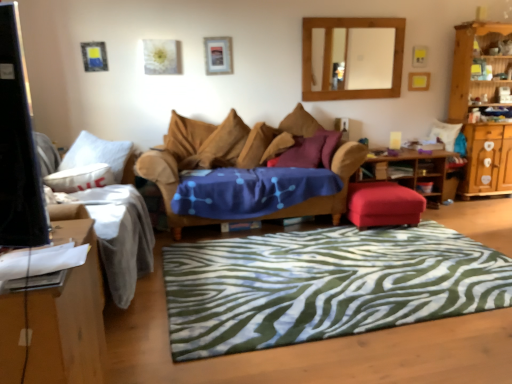
What do you see at coordinates (183, 160) in the screenshot? The image size is (512, 384). I see `velvet brown couch at center, placed as the 1th studio couch when sorted from right to left` at bounding box center [183, 160].

The height and width of the screenshot is (384, 512). What do you see at coordinates (362, 58) in the screenshot? I see `wooden framed mirror at upper center` at bounding box center [362, 58].

This screenshot has width=512, height=384. I want to click on red fabric ottoman at lower right, so click(x=383, y=204).

What do you see at coordinates (323, 285) in the screenshot?
I see `green zebra-patterned rug at center` at bounding box center [323, 285].

Find the location of a particular element. Image resolution: width=512 pixels, height=384 pixels. wooden desk at left is located at coordinates (69, 317).

Where is `the 2nd pillow above the brown fabric pillow at center, the 2th pillow positioned from the right (from the image's perspective)`? This screenshot has height=384, width=512. the 2nd pillow above the brown fabric pillow at center, the 2th pillow positioned from the right (from the image's perspective) is located at coordinates (300, 123).

From a real-world perspective, which is physically below, purple fabric pillow at center, the 4th pillow when ordered from left to right, or brown fabric pillow at center, positioned as the 3th pillow in left-to-right order?

brown fabric pillow at center, positioned as the 3th pillow in left-to-right order, is physically lower.

Is purple fabric pillow at center, the 4th pillow when ordered from left to right, looking in the opposite direction of brown fabric pillow at center, the 2th pillow positioned from the right?

No.

Could brown fabric pillow at center, positioned as the 3th pillow in left-to-right order, be considered to be inside purple fabric pillow at center, positioned as the 1th pillow in right-to-left order?

No, purple fabric pillow at center, positioned as the 1th pillow in right-to-left order, does not contain brown fabric pillow at center, positioned as the 3th pillow in left-to-right order.

From a real-world perspective, is white fabric couch at left, the 1th studio couch in the left-to-right sequence, physically located above or below green zebra-patterned rug at center?

In terms of real-world spatial position, white fabric couch at left, the 1th studio couch in the left-to-right sequence, is above green zebra-patterned rug at center.

From the image's perspective, would you say white fabric couch at left, positioned as the second studio couch in right-to-left order, is shown under green zebra-patterned rug at center?

No, from the image's perspective, white fabric couch at left, positioned as the second studio couch in right-to-left order, is not below green zebra-patterned rug at center.

Is white fabric couch at left, positioned as the second studio couch in right-to-left order, positioned with its back to green zebra-patterned rug at center?

No.

The height and width of the screenshot is (384, 512). What are the coordinates of `the 2nd studio couch counting from the left of the green zebra-patterned rug at center` in the screenshot? It's located at (115, 216).

From the image's perspective, would you say white fabric couch at left, positioned as the second studio couch in right-to-left order, is positioned over wooden shelf at center?

No, from the image's perspective, white fabric couch at left, positioned as the second studio couch in right-to-left order, is not above wooden shelf at center.

How much distance is there between white fabric couch at left, the 1th studio couch in the left-to-right sequence, and wooden shelf at center?

2.43 meters.

Is the surface of white fabric couch at left, positioned as the second studio couch in right-to-left order, in direct contact with wooden shelf at center?

No, white fabric couch at left, positioned as the second studio couch in right-to-left order, is not touching wooden shelf at center.

From a real-world perspective, is white fabric couch at left, the 1th studio couch in the left-to-right sequence, physically located above or below wooden shelf at center?

In terms of real-world spatial position, white fabric couch at left, the 1th studio couch in the left-to-right sequence, is above wooden shelf at center.

Which point is more distant from viewer, (62, 356) or (372, 202)?

Point (372, 202)

Looking at this image, from a real-world perspective, is wooden desk at left physically located above or below red fabric ottoman at lower right?

From a real-world perspective, wooden desk at left is physically above red fabric ottoman at lower right.

Considering the relative sizes of wooden desk at left and red fabric ottoman at lower right in the image provided, is wooden desk at left taller than red fabric ottoman at lower right?

Indeed, wooden desk at left has a greater height compared to red fabric ottoman at lower right.

Between wooden desk at left and red fabric ottoman at lower right, which one has smaller width?

red fabric ottoman at lower right is thinner.

From the picture: Between wooden framed mirror at upper center and brown fabric pillow at center, the 2th pillow from the left, which one has smaller width?

wooden framed mirror at upper center is thinner.

From a real-world perspective, is wooden framed mirror at upper center beneath brown fabric pillow at center, the 2th pillow from the left?

No.

In the image, is wooden framed mirror at upper center positioned in front of or behind brown fabric pillow at center, the 2th pillow from the left?

Clearly, wooden framed mirror at upper center is behind brown fabric pillow at center, the 2th pillow from the left.

From the image's perspective, which is below, wooden framed mirror at upper center or brown fabric pillow at center, arranged as the third pillow when viewed from the right?

From the image's view, brown fabric pillow at center, arranged as the third pillow when viewed from the right, is below.

Is wooden cabinet at right located within red fabric ottoman at lower right?

No, wooden cabinet at right is not surrounded by red fabric ottoman at lower right.

This screenshot has width=512, height=384. I want to click on stool on the left of the wooden cabinet at right, so click(383, 204).

Considering the sizes of red fabric ottoman at lower right and wooden cabinet at right in the image, is red fabric ottoman at lower right wider or thinner than wooden cabinet at right?

red fabric ottoman at lower right is wider than wooden cabinet at right.

Is red fabric ottoman at lower right positioned before wooden cabinet at right?

Yes, red fabric ottoman at lower right is closer to the viewer.

Is brown fabric pillow at center, positioned as the 3th pillow in left-to-right order, bigger or smaller than metallic silver picture frame at upper center?

Considering their sizes, brown fabric pillow at center, positioned as the 3th pillow in left-to-right order, takes up more space than metallic silver picture frame at upper center.

From the image's perspective, which is below, brown fabric pillow at center, positioned as the 3th pillow in left-to-right order, or metallic silver picture frame at upper center?

brown fabric pillow at center, positioned as the 3th pillow in left-to-right order, from the image's perspective.

Is brown fabric pillow at center, positioned as the 3th pillow in left-to-right order, next to metallic silver picture frame at upper center and touching it?

No, brown fabric pillow at center, positioned as the 3th pillow in left-to-right order, is not in contact with metallic silver picture frame at upper center.

From a real-world perspective, which object stands above the other?

From a 3D spatial view, metallic silver picture frame at upper center is above.

Find the location of a particular element. pillow that is the 1st object to the left of the purple fabric pillow at center, the 4th pillow when ordered from left to right, starting at the anchor is located at coordinates (x=277, y=146).

The width and height of the screenshot is (512, 384). What are the coordinates of `mat behind the white fabric couch at left, positioned as the second studio couch in right-to-left order` in the screenshot? It's located at (323, 285).

Which object lies nearer to the anchor point purple fabric pillow at center, positioned as the 1th pillow in right-to-left order, brown fabric pillow at center, arranged as the third pillow when viewed from the right, or green zebra-patterned rug at center?

brown fabric pillow at center, arranged as the third pillow when viewed from the right, lies closer to purple fabric pillow at center, positioned as the 1th pillow in right-to-left order, than the other object.

Based on their spatial positions, is wooden framed mirror at upper center or white fabric couch at left, the 1th studio couch in the left-to-right sequence, closer to green zebra-patterned rug at center?

white fabric couch at left, the 1th studio couch in the left-to-right sequence, is positioned closer to the anchor green zebra-patterned rug at center.

Based on the photo, based on their spatial positions, is wooden cabinet at right or brown fabric pillow at center, arranged as the third pillow when viewed from the right, closer to white fabric couch at left, positioned as the second studio couch in right-to-left order?

Among the two, brown fabric pillow at center, arranged as the third pillow when viewed from the right, is located nearer to white fabric couch at left, positioned as the second studio couch in right-to-left order.

When comparing their distances from metallic silver picture frame at upper center, does wooden desk at left or wooden framed mirror at upper center seem further?

Among the two, wooden desk at left is located further to metallic silver picture frame at upper center.

From the image, which object appears to be nearer to white soft pillow at left, the first pillow positioned from the left, brown fabric pillow at center, the 2th pillow positioned from the right, or red fabric ottoman at lower right?

Among the two, brown fabric pillow at center, the 2th pillow positioned from the right, is located nearer to white soft pillow at left, the first pillow positioned from the left.

From the image, which object appears to be nearer to metallic silver picture frame at upper center, green zebra-patterned rug at center or wooden desk at left?

Result: green zebra-patterned rug at center lies closer to metallic silver picture frame at upper center than the other object.

Considering their positions, is brown fabric pillow at center, the 2th pillow from the left, positioned closer to white fabric couch at left, positioned as the second studio couch in right-to-left order, than wooden cabinet at right?

Based on the image, brown fabric pillow at center, the 2th pillow from the left, appears to be nearer to white fabric couch at left, positioned as the second studio couch in right-to-left order.

Based on their spatial positions, is wooden framed mirror at upper center or green zebra-patterned rug at center further from red fabric ottoman at lower right?

wooden framed mirror at upper center lies further to red fabric ottoman at lower right than the other object.

Where is `stool located between wooden desk at left and metallic silver picture frame at upper center in the depth direction`? This screenshot has width=512, height=384. stool located between wooden desk at left and metallic silver picture frame at upper center in the depth direction is located at coordinates (383, 204).

Locate an element on the screen. Image resolution: width=512 pixels, height=384 pixels. picture frame between wooden desk at left and wooden framed mirror at upper center in the front-back direction is located at coordinates (218, 55).

You are a GUI agent. You are given a task and a screenshot of the screen. Output one action in this format:
    pyautogui.click(x=<x>, y=<y>)
    Task: Click on the stool between purple fabric pillow at center, positioned as the 1th pillow in right-to-left order, and wooden shelf at center, in the horizontal direction
    The width and height of the screenshot is (512, 384).
    Given the screenshot: What is the action you would take?
    pyautogui.click(x=383, y=204)

Find the location of `mat located between wooden desk at left and velvet brown couch at center, which is counted as the 2th studio couch, starting from the left, in the depth direction`. mat located between wooden desk at left and velvet brown couch at center, which is counted as the 2th studio couch, starting from the left, in the depth direction is located at coordinates (323, 285).